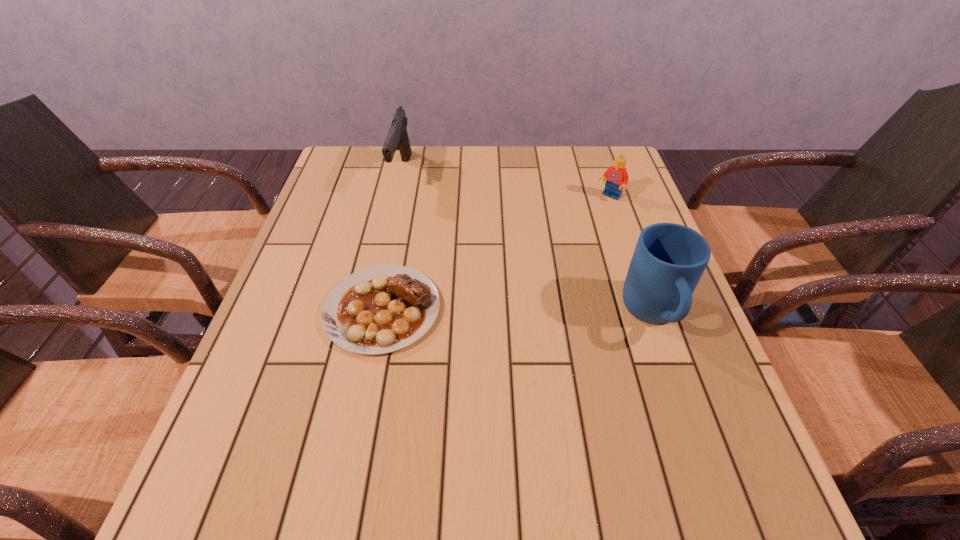
The height and width of the screenshot is (540, 960). In the image, there is a desktop. Identify the location of free region at the near left corner. (281, 428).

This screenshot has height=540, width=960. I want to click on free point at the near right corner, so click(660, 430).

I want to click on free area in between the Lego and the shortest object, so click(495, 253).

Image resolution: width=960 pixels, height=540 pixels. What are the coordinates of `free space between the mug and the second shortest object` in the screenshot? It's located at (632, 256).

Locate an element on the screen. This screenshot has width=960, height=540. free space between the mug and the gun is located at coordinates (528, 244).

At what (x,y) coordinates should I click in order to perform the action: click on free space between the shortest object and the mug. Please return your answer as a coordinate pair (x, y). The image size is (960, 540). Looking at the image, I should click on (517, 312).

Find the location of `free area in between the Lego and the gun`. free area in between the Lego and the gun is located at coordinates (506, 185).

Where is `unoccupied position between the gun and the Lego`? unoccupied position between the gun and the Lego is located at coordinates [506, 185].

The height and width of the screenshot is (540, 960). Find the location of `unoccupied position between the mug and the gun`. unoccupied position between the mug and the gun is located at coordinates point(528,244).

Where is `free point between the gun and the mug`? Image resolution: width=960 pixels, height=540 pixels. free point between the gun and the mug is located at coordinates (528, 244).